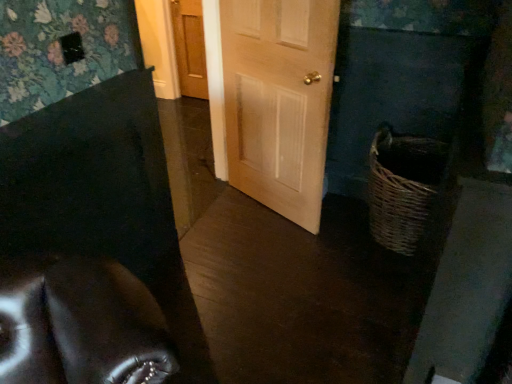
Find the location of a particular element. The image size is (512, 384). vacant space that is to the left of woven brown basket at lower right is located at coordinates (325, 243).